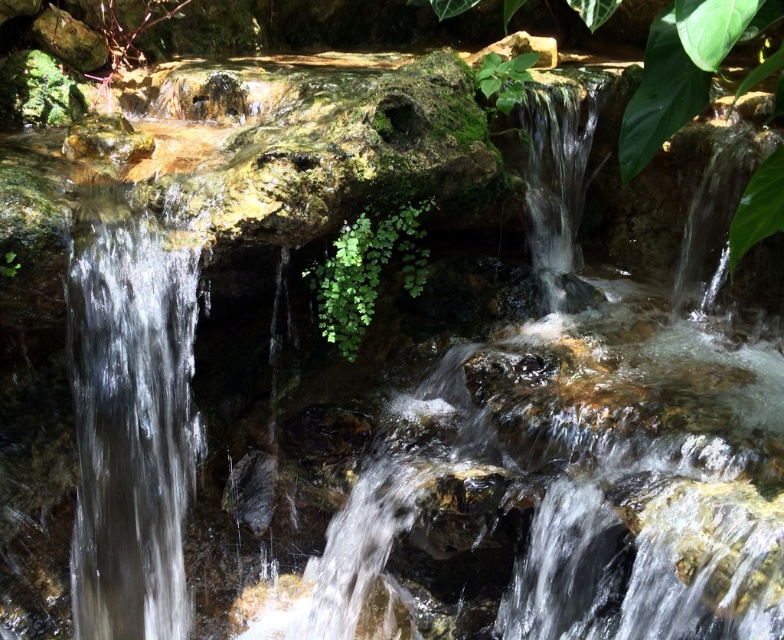
Does clear glass waterfall at left appear on the left side of green leafy plant at upper center?

Indeed, clear glass waterfall at left is positioned on the left side of green leafy plant at upper center.

Locate an element on the screen. clear glass waterfall at left is located at coordinates (129, 419).

Identify the location of clear glass waterfall at left. (129, 419).

Which is more to the right, clear glass waterfall at left or green leafy plant at center?

Positioned to the right is green leafy plant at center.

Who is lower down, clear glass waterfall at left or green leafy plant at center?

clear glass waterfall at left

Is point (82, 332) farther from viewer compared to point (339, 300)?

That is False.

Where is `clear glass waterfall at left`? The image size is (784, 640). clear glass waterfall at left is located at coordinates (129, 419).

Who is lower down, green leafy plant at center or green leafy plant at upper center?

Positioned lower is green leafy plant at center.

Who is higher up, green leafy plant at center or green leafy plant at upper center?

Positioned higher is green leafy plant at upper center.

Identify the location of green leafy plant at center. The height and width of the screenshot is (640, 784). (365, 272).

Locate an element on the screen. This screenshot has height=640, width=784. green leafy plant at center is located at coordinates (365, 272).